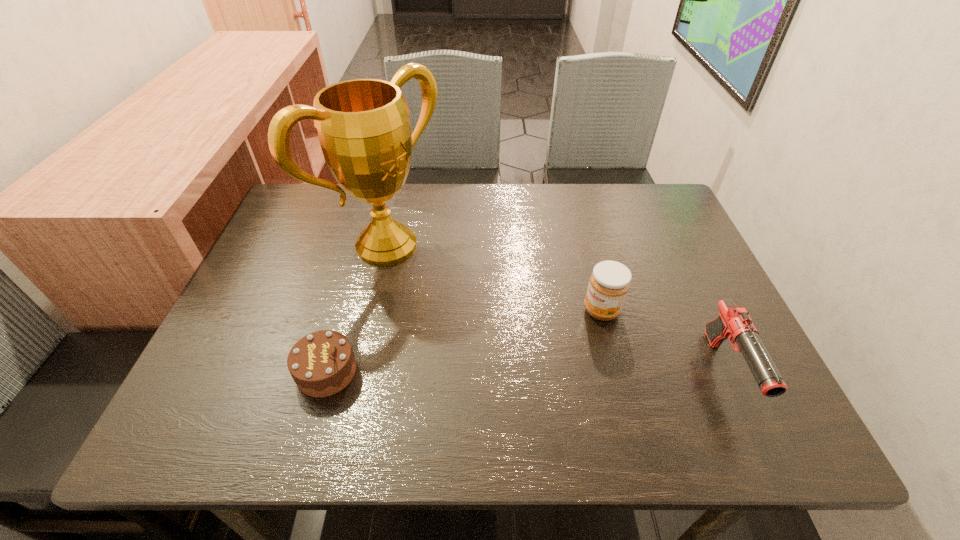
The image size is (960, 540). I want to click on vacant space at the left edge of the desktop, so click(306, 273).

I want to click on free space at the right edge of the desktop, so click(x=671, y=273).

The width and height of the screenshot is (960, 540). I want to click on vacant space at the far left corner, so click(324, 192).

This screenshot has height=540, width=960. Identify the location of vacant space at the far right corner. (615, 200).

The image size is (960, 540). I want to click on free space at the near right corner of the desktop, so click(732, 362).

This screenshot has width=960, height=540. Find the location of `vacant space that is in between the third object from left to right and the award`. vacant space that is in between the third object from left to right and the award is located at coordinates (494, 278).

At what (x,y) coordinates should I click in order to perform the action: click on unoccupied area between the tallest object and the jam. Please return your answer as a coordinate pair (x, y). The width and height of the screenshot is (960, 540). Looking at the image, I should click on (494, 278).

Identify the location of free spot between the shortest object and the farthest object. The image size is (960, 540). (357, 308).

Locate an element on the screen. The image size is (960, 540). unoccupied position between the third object from left to right and the gun is located at coordinates (664, 341).

Identify the location of free spot between the gun and the shortest object. (526, 372).